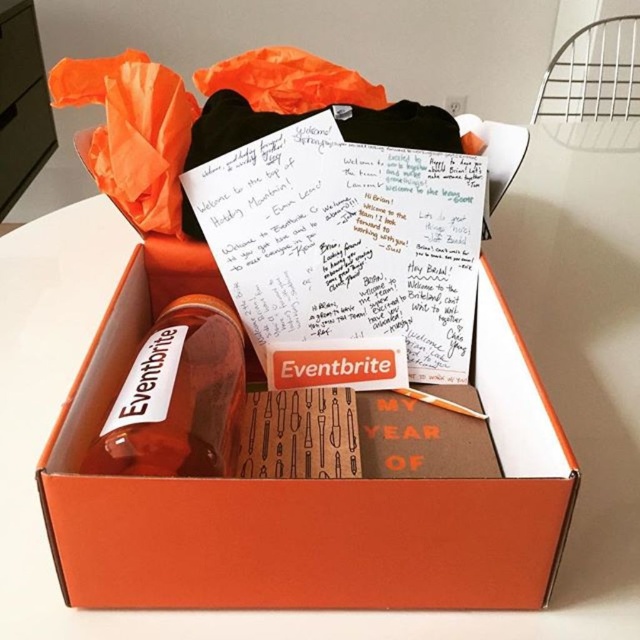
Question: Among these points, which one is nearest to the camera?

Choices:
 (A) (97, 442)
 (B) (116, 348)

Answer: (A)

Question: Which object appears farthest from the camera in this image?

Choices:
 (A) orange matte box at center
 (B) orange matte drawer at upper left

Answer: (B)

Question: Does translucent glass bottle at center appear under orange matte drawer at upper left?

Choices:
 (A) no
 (B) yes

Answer: (B)

Question: Which object is closer to the camera taking this photo?

Choices:
 (A) orange matte box at center
 (B) orange matte drawer at upper left
 (C) translucent glass bottle at center

Answer: (A)

Question: Is orange matte box at center below orange matte drawer at upper left?

Choices:
 (A) no
 (B) yes

Answer: (B)

Question: Does orange matte box at center have a lesser width compared to orange matte drawer at upper left?

Choices:
 (A) no
 (B) yes

Answer: (A)